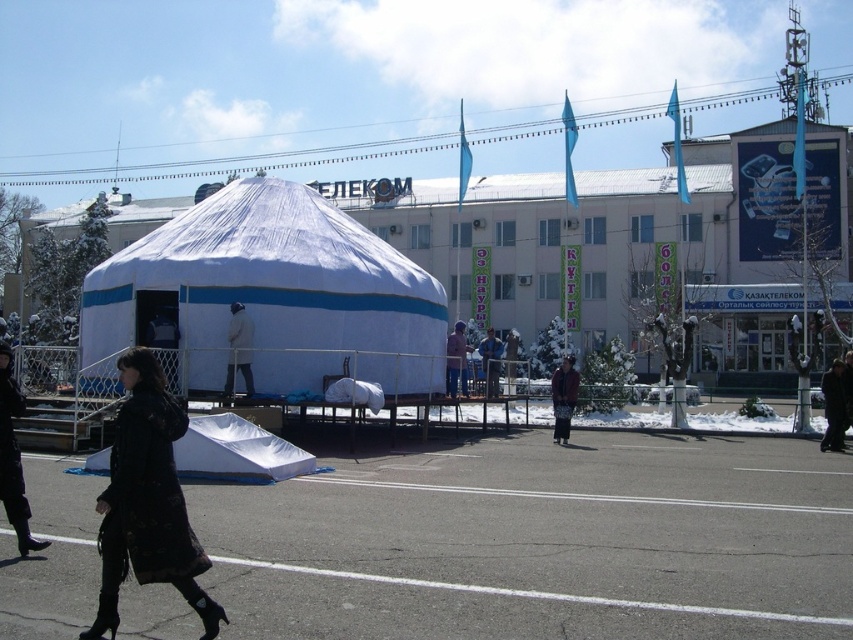
Can you confirm if white fabric tent at center is thinner than dark gray fabric jacket at center?

No.

Can you confirm if white fabric tent at center is positioned to the left of dark gray fabric jacket at center?

In fact, white fabric tent at center is to the right of dark gray fabric jacket at center.

Which is in front, point (409, 259) or point (238, 339)?

Point (238, 339) is more forward.

I want to click on white fabric tent at center, so click(268, 296).

Is point (294, 250) positioned behind point (100, 472)?

Yes, point (294, 250) is farther from viewer.

Between point (260, 394) and point (251, 433), which one is positioned behind?

Point (260, 394)

Is point (131, 278) in front of point (218, 445)?

No, it is not.

Where is `white fabric tent at center`? white fabric tent at center is located at coordinates (268, 296).

Who is positioned more to the left, dark gray fabric jacket at center or light brown fabric jacket at center?

dark gray fabric jacket at center is more to the left.

In the scene shown: Does dark gray fabric jacket at center lie behind light brown fabric jacket at center?

That is False.

Is point (242, 308) less distant than point (462, 332)?

Yes, it is in front of point (462, 332).

Find the location of a particular element. dark gray fabric jacket at center is located at coordinates (239, 349).